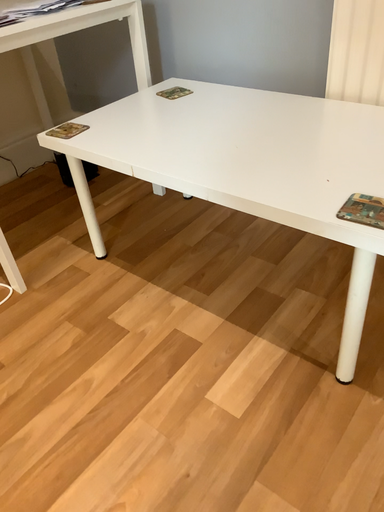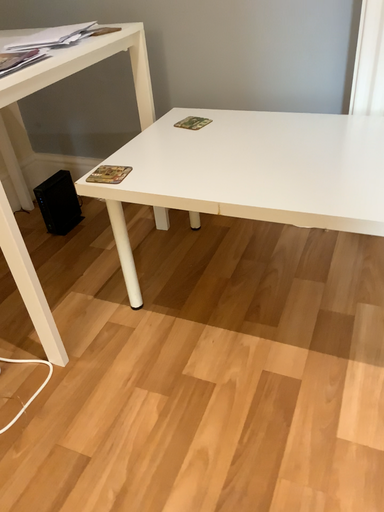
Question: Which way did the camera rotate in the video?

Choices:
 (A) rotated left
 (B) rotated right

Answer: (B)